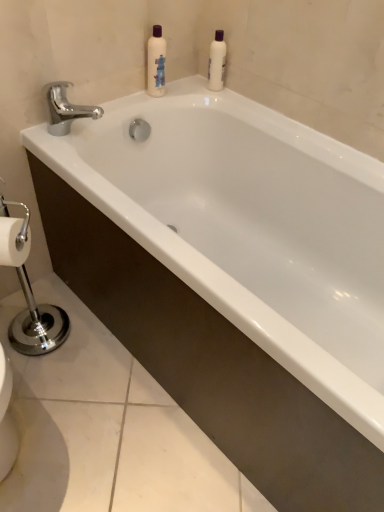
This screenshot has height=512, width=384. Find the location of `free location in front of white plastic bottle at upper center, the second cleaning product when ordered from left to right`. free location in front of white plastic bottle at upper center, the second cleaning product when ordered from left to right is located at coordinates (232, 97).